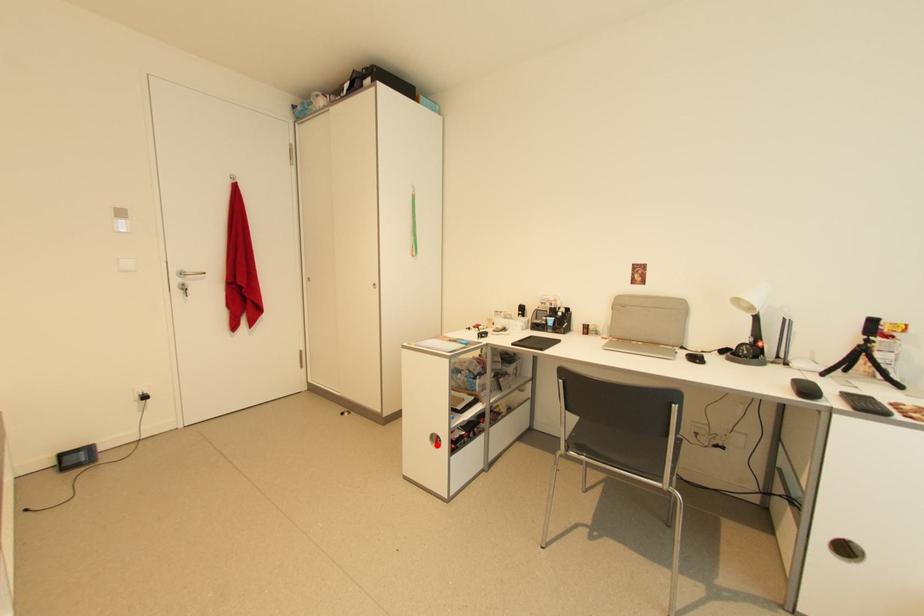
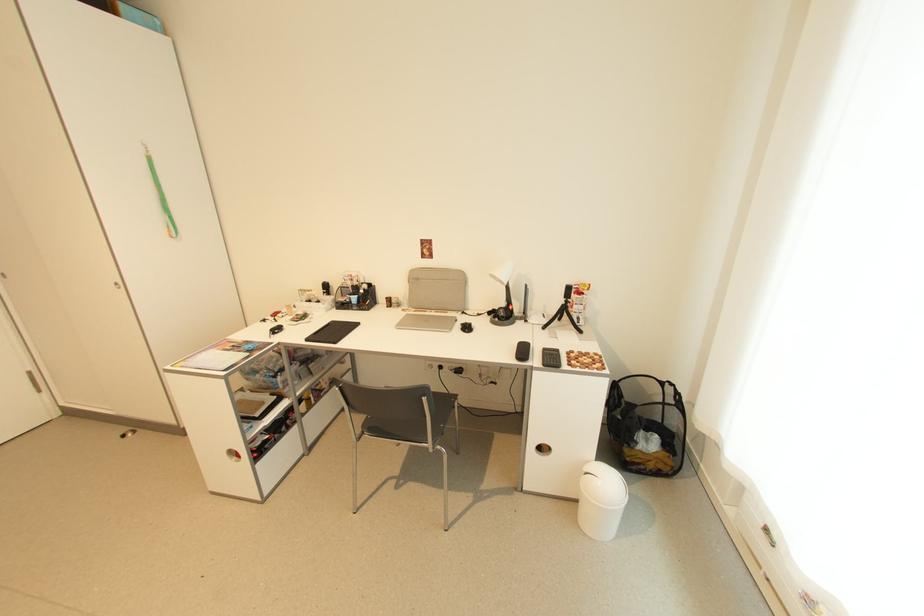
In the second image, find the point that corresponds to the highlighted location in the first image.

(237, 460)